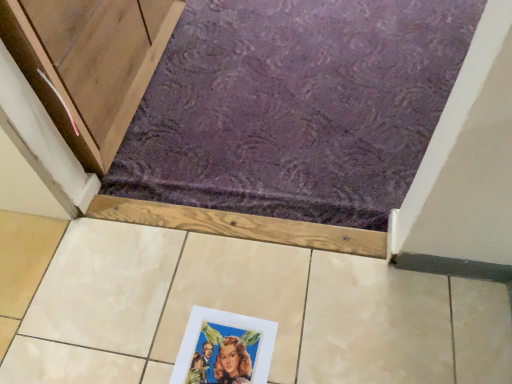
What do you see at coordinates (295, 107) in the screenshot? I see `purple textured carpet at upper center` at bounding box center [295, 107].

What is the approximate width of purple textured carpet at upper center?

It is 1.18 meters.

At what (x,y) coordinates should I click in order to perform the action: click on purple textured carpet at upper center. Please return your answer as a coordinate pair (x, y). Looking at the image, I should click on (295, 107).

Locate an element on the screen. The width and height of the screenshot is (512, 384). matte paper picture frame at lower center is located at coordinates (224, 349).

Describe the element at coordinates (224, 349) in the screenshot. The height and width of the screenshot is (384, 512). I see `matte paper picture frame at lower center` at that location.

Measure the distance between point (207, 313) and camera.

Point (207, 313) is 3.36 feet from camera.

Locate an element on the screen. purple textured carpet at upper center is located at coordinates coord(295,107).

Based on their positions, is matte paper picture frame at lower center located to the left or right of purple textured carpet at upper center?

Based on their positions, matte paper picture frame at lower center is located to the left of purple textured carpet at upper center.

Which is behind, matte paper picture frame at lower center or purple textured carpet at upper center?

purple textured carpet at upper center is further away from the camera.

Between point (215, 331) and point (262, 150), which one is positioned in front?

Point (215, 331)

From the image's perspective, would you say matte paper picture frame at lower center is positioned over purple textured carpet at upper center?

Actually, matte paper picture frame at lower center appears below purple textured carpet at upper center in the image.

Based on the photo, from a real-world perspective, is matte paper picture frame at lower center above or below purple textured carpet at upper center?

In terms of real-world spatial position, matte paper picture frame at lower center is above purple textured carpet at upper center.

Which of these two, matte paper picture frame at lower center or purple textured carpet at upper center, is thinner?

matte paper picture frame at lower center.

Who is shorter, matte paper picture frame at lower center or purple textured carpet at upper center?

Standing shorter between the two is matte paper picture frame at lower center.

Looking at the image, does matte paper picture frame at lower center seem bigger or smaller compared to purple textured carpet at upper center?

Considering their sizes, matte paper picture frame at lower center takes up less space than purple textured carpet at upper center.

Is purple textured carpet at upper center a part of matte paper picture frame at lower center?

No, purple textured carpet at upper center is not surrounded by matte paper picture frame at lower center.

Is matte paper picture frame at lower center not close to purple textured carpet at upper center?

Actually, matte paper picture frame at lower center and purple textured carpet at upper center are a little close together.

Is matte paper picture frame at lower center aimed at purple textured carpet at upper center?

Yes, matte paper picture frame at lower center faces towards purple textured carpet at upper center.

What's the angular difference between matte paper picture frame at lower center and purple textured carpet at upper center's facing directions?

The angular difference between matte paper picture frame at lower center and purple textured carpet at upper center is 178 degrees.

Image resolution: width=512 pixels, height=384 pixels. Identify the location of bath mat behind the matte paper picture frame at lower center. (295, 107).

Considering the positions of objects purple textured carpet at upper center and matte paper picture frame at lower center in the image provided, who is more to the right, purple textured carpet at upper center or matte paper picture frame at lower center?

purple textured carpet at upper center.

Is purple textured carpet at upper center in front of or behind matte paper picture frame at lower center in the image?

purple textured carpet at upper center is behind matte paper picture frame at lower center.

Considering the points (345, 197) and (254, 337), which point is in front, point (345, 197) or point (254, 337)?

Point (254, 337)

From the image's perspective, is purple textured carpet at upper center located above matte paper picture frame at lower center?

Yes, from the image's perspective, purple textured carpet at upper center is on top of matte paper picture frame at lower center.

From a real-world perspective, which is physically below, purple textured carpet at upper center or matte paper picture frame at lower center?

purple textured carpet at upper center.

Considering the relative sizes of purple textured carpet at upper center and matte paper picture frame at lower center in the image provided, is purple textured carpet at upper center thinner than matte paper picture frame at lower center?

In fact, purple textured carpet at upper center might be wider than matte paper picture frame at lower center.

Which of these two, purple textured carpet at upper center or matte paper picture frame at lower center, stands taller?

Standing taller between the two is purple textured carpet at upper center.

Who is smaller, purple textured carpet at upper center or matte paper picture frame at lower center?

matte paper picture frame at lower center is smaller.

Is purple textured carpet at upper center situated inside matte paper picture frame at lower center or outside?

The correct answer is: outside.

Are purple textured carpet at upper center and matte paper picture frame at lower center far apart?

That's not correct — purple textured carpet at upper center is a little close to matte paper picture frame at lower center.

Could you tell me if purple textured carpet at upper center is facing matte paper picture frame at lower center?

Yes, purple textured carpet at upper center is oriented towards matte paper picture frame at lower center.

Measure the distance from purple textured carpet at upper center to matte paper picture frame at lower center.

purple textured carpet at upper center is 30.22 inches from matte paper picture frame at lower center.

This screenshot has height=384, width=512. In order to click on bath mat below the matte paper picture frame at lower center (from a real-world perspective) in this screenshot , I will do `click(295, 107)`.

Locate an element on the screen. bath mat above the matte paper picture frame at lower center (from the image's perspective) is located at coordinates (295, 107).

Identify the location of bath mat below the matte paper picture frame at lower center (from a real-world perspective). 295,107.